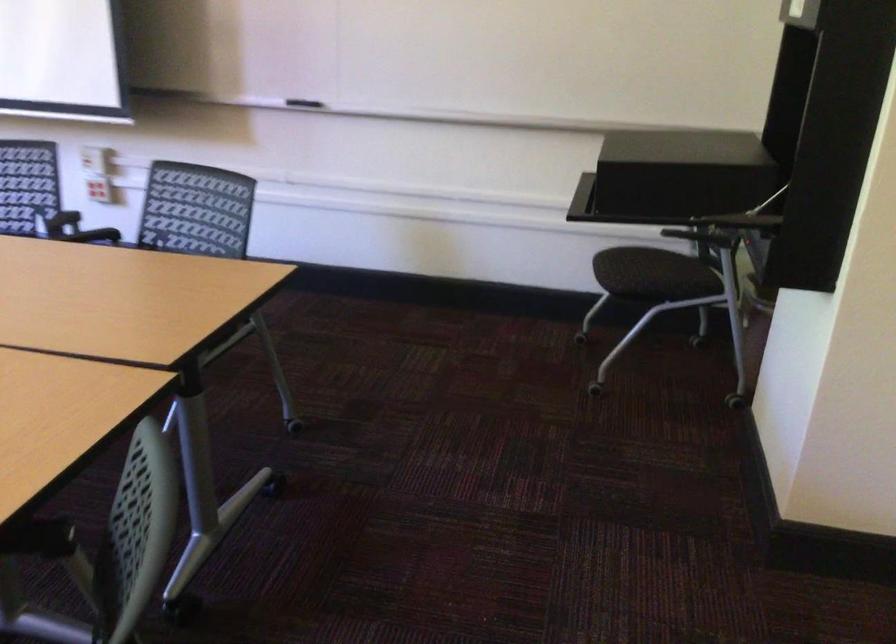
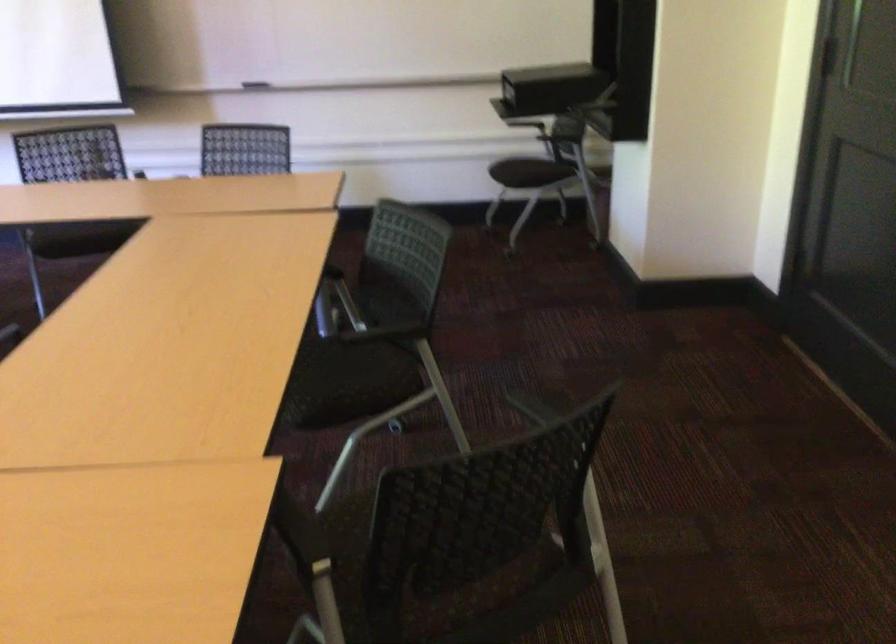
Locate, in the second image, the point that corresponds to point 670,192 in the first image.

(549, 88)